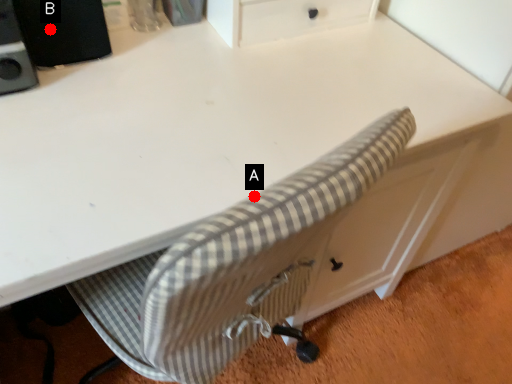
Question: Two points are circled on the image, labeled by A and B beside each circle. Which point appears farthest from the camera in this image?

Choices:
 (A) A is further
 (B) B is further

Answer: (B)